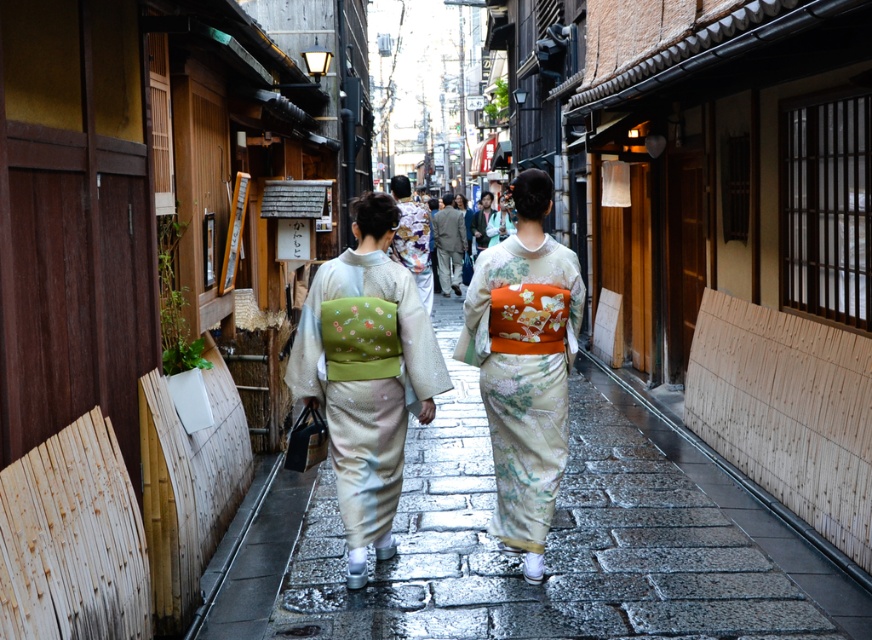
Is point (825, 572) positioned after point (546, 451)?

Yes.

Can you confirm if smooth stone pavement at center is shorter than silky white kimono at center?

Yes.

Image resolution: width=872 pixels, height=640 pixels. Describe the element at coordinates (546, 545) in the screenshot. I see `smooth stone pavement at center` at that location.

This screenshot has height=640, width=872. In order to click on smooth stone pavement at center in this screenshot , I will do `click(546, 545)`.

In the scene shown: Can you confirm if matte green kimono at center is positioned below silky white kimono at center?

Yes, matte green kimono at center is below silky white kimono at center.

Is matte green kimono at center positioned in front of silky white kimono at center?

Yes.

Which is in front, point (355, 220) or point (529, 200)?

Positioned in front is point (529, 200).

Locate an element on the screen. matte green kimono at center is located at coordinates (366, 374).

Between smooth stone pavement at center and matte green kimono at center, which one appears on the right side from the viewer's perspective?

matte green kimono at center is more to the right.

Is point (755, 627) closer to viewer compared to point (348, 554)?

Yes, point (755, 627) is in front of point (348, 554).

The image size is (872, 640). I want to click on smooth stone pavement at center, so click(546, 545).